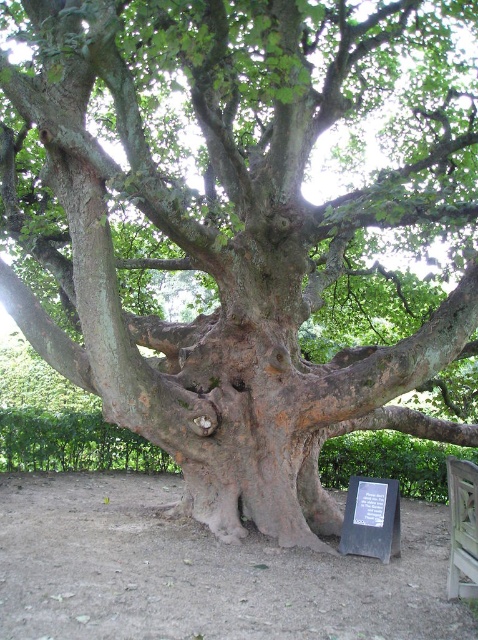
You are a park visitor who wants to sit on the wooden bench at lower right while reading the black stone plaque at lower center. Can you sit on the bench and still be able to see the entire text on the plaque?

The black stone plaque at lower center is wider than the wooden bench at lower right, so if you sit on the bench, you might not be able to see the entire text on the plaque because its width exceeds the bench.

You are standing at the base of the ancient tree and want to find the black stone plaque at lower center. According to the coordinates provided, where should you look relative to your current position?

The black stone plaque at lower center is located at coordinates point [371,518], which means it is positioned to the right and slightly below your current position at the base of the tree.

You are standing at the base of the ancient tree and want to place a small potted plant exactly at point [371,518]. However, there is already an object there. What is it?

The point [371,518] is occupied by the black stone plaque at lower center.